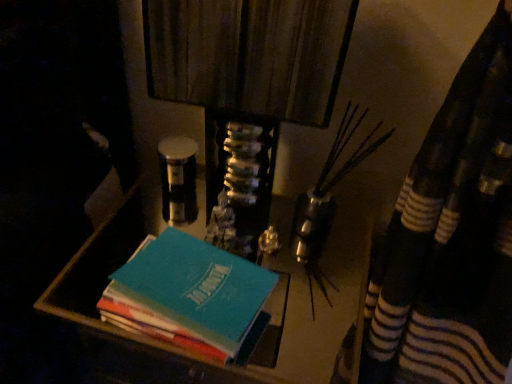
This screenshot has height=384, width=512. I want to click on free space above teal matte book at center (from a real-world perspective), so click(x=184, y=281).